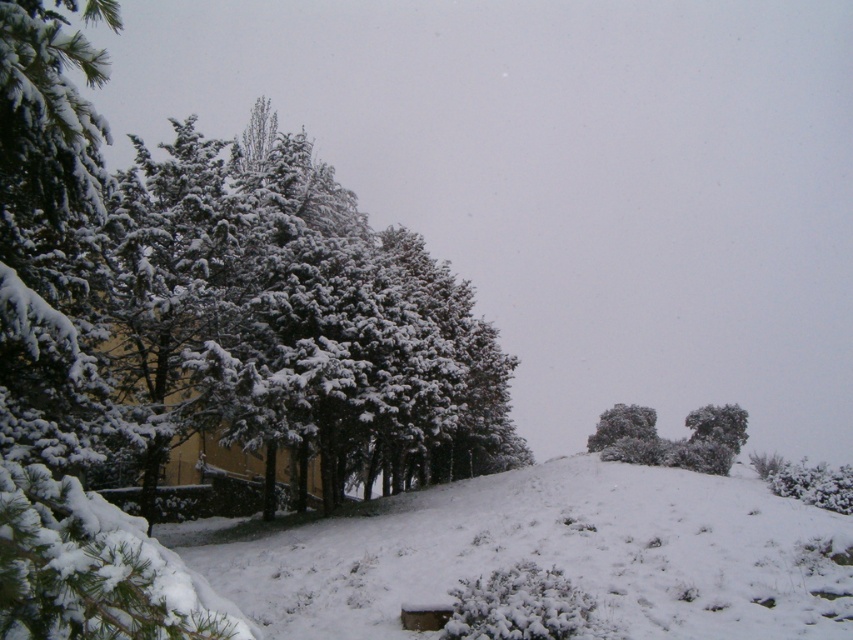
Question: Does white snow-covered hillside at center have a smaller size compared to white fluffy snow at center?

Choices:
 (A) yes
 (B) no

Answer: (B)

Question: Which point is closer to the camera taking this photo?

Choices:
 (A) (343, 560)
 (B) (590, 451)

Answer: (A)

Question: Does white snow-covered hillside at center have a smaller size compared to white fluffy snow at center?

Choices:
 (A) yes
 (B) no

Answer: (B)

Question: Is white snow-covered hillside at center below white fluffy snow at center?

Choices:
 (A) yes
 (B) no

Answer: (B)